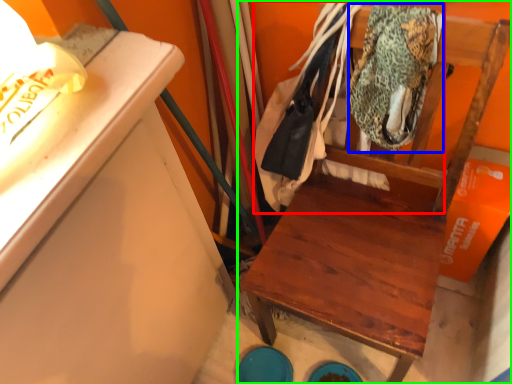
Question: Based on their relative distances, which object is farther from laundry (highlighted by a red box)? Choose from clothing (highlighted by a blue box) and furniture (highlighted by a green box).

Choices:
 (A) clothing
 (B) furniture

Answer: (B)